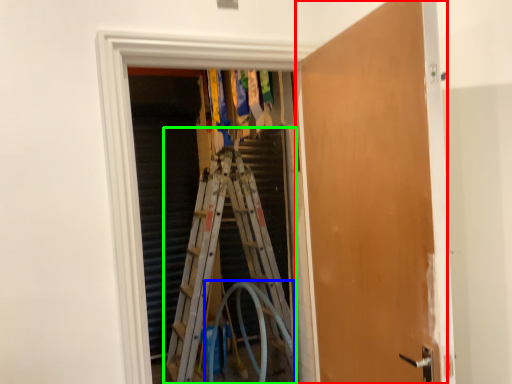
Question: Which object is the farthest from door (highlighted by a red box)? Choose among these: garden hose (highlighted by a blue box) or ladder (highlighted by a green box).

Choices:
 (A) garden hose
 (B) ladder

Answer: (B)